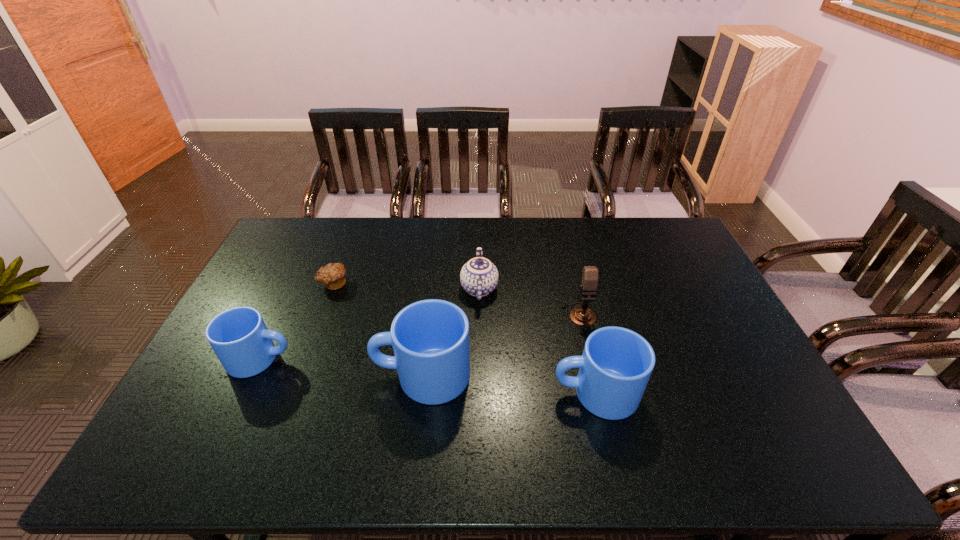
Identify the location of the shortest mug. (239, 337).

Where is `the second mug from right to left`? This screenshot has width=960, height=540. the second mug from right to left is located at coordinates (430, 338).

Identify the location of the second shortest mug. (614, 369).

Locate an element on the screen. the shortest object is located at coordinates (332, 275).

Where is `chinaware`? The image size is (960, 540). chinaware is located at coordinates (479, 276).

You are a GUI agent. You are given a task and a screenshot of the screen. Output one action in this format:
    pyautogui.click(x=<x>, y=<y>)
    Task: Click on the microphone
    Image resolution: width=960 pixels, height=540 pixels.
    Given the screenshot: What is the action you would take?
    pyautogui.click(x=582, y=316)

Where is `vacant area situated on the side of the shortest mug with the handle`? The height and width of the screenshot is (540, 960). vacant area situated on the side of the shortest mug with the handle is located at coordinates (400, 359).

Where is `free region located on the side of the second mug from left to right with the handle`? This screenshot has width=960, height=540. free region located on the side of the second mug from left to right with the handle is located at coordinates (355, 375).

The height and width of the screenshot is (540, 960). I want to click on free space located on the side of the second mug from left to right with the handle, so click(x=348, y=375).

This screenshot has height=540, width=960. In order to click on blank space located 0.050m on the side of the second mug from left to right with the handle in this screenshot , I will do `click(355, 375)`.